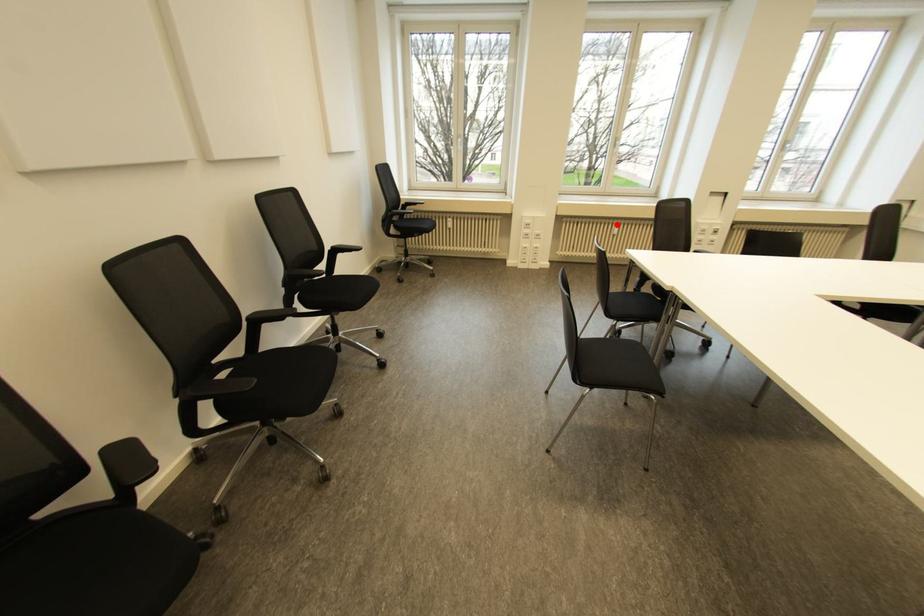
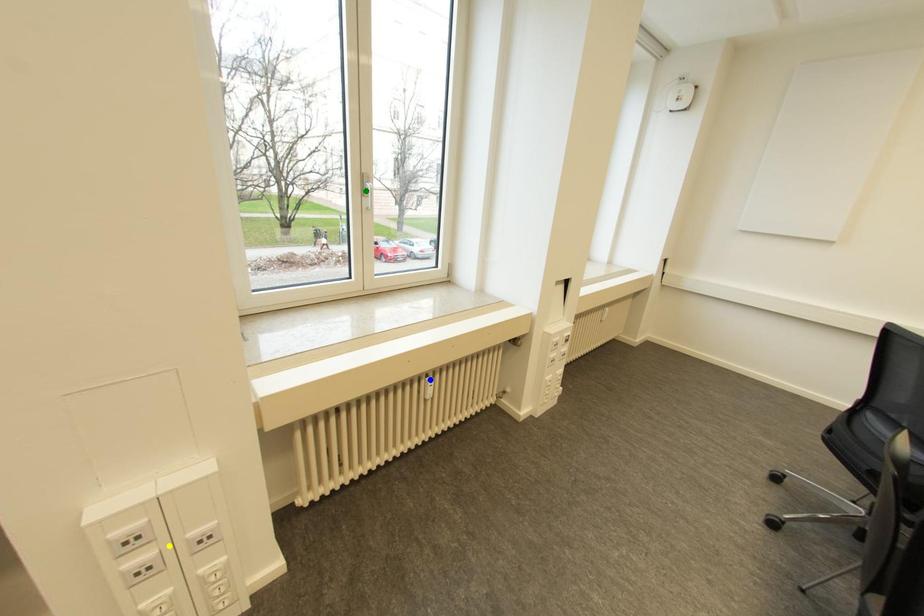
Question: I am providing you with two images of the same scene from different viewpoints. A red point is marked on the first image. You are given multiple points on the second image. Which point in image 2 represents the same 3d spot as the red point in image 1?

Choices:
 (A) blue point
 (B) yellow point
 (C) green point

Answer: (A)